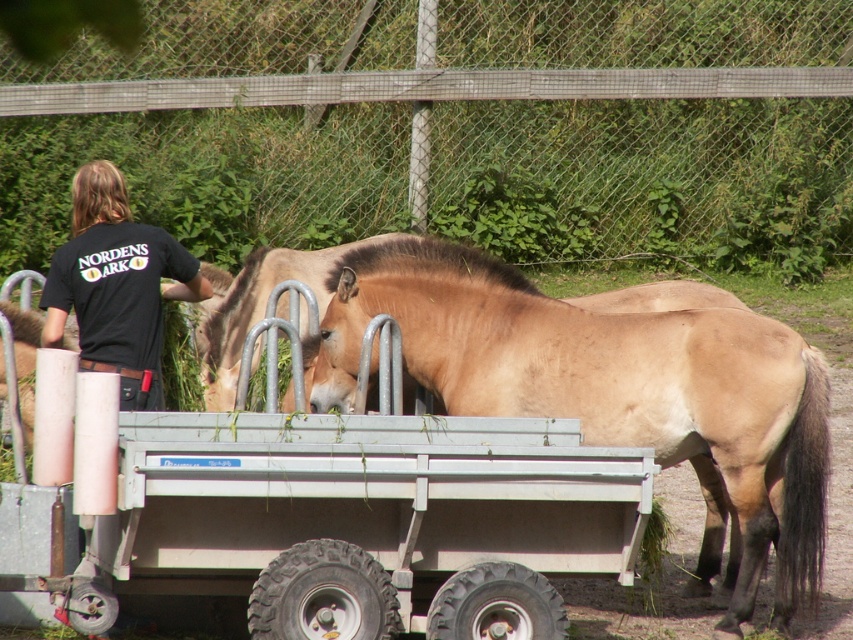
Between metal mesh fence at upper center and brown matte horse at center, which one appears on the left side from the viewer's perspective?

Positioned to the left is metal mesh fence at upper center.

The width and height of the screenshot is (853, 640). I want to click on metal mesh fence at upper center, so click(x=453, y=129).

Is metal mesh fence at upper center below metallic silver wagon at center?

No.

Is the position of metal mesh fence at upper center less distant than that of metallic silver wagon at center?

No, metal mesh fence at upper center is further to the viewer.

Consider the image. Who is more forward, (851, 99) or (325, 532)?

Positioned in front is point (325, 532).

What are the coordinates of `metal mesh fence at upper center` in the screenshot? It's located at (453, 129).

Does metal mesh fence at upper center have a greater height compared to black cotton shirt at upper left?

Yes.

Is metal mesh fence at upper center to the left of black cotton shirt at upper left from the viewer's perspective?

No, metal mesh fence at upper center is not to the left of black cotton shirt at upper left.

Is point (584, 52) more distant than point (62, 300)?

That is True.

Where is `metal mesh fence at upper center`? The image size is (853, 640). metal mesh fence at upper center is located at coordinates (453, 129).